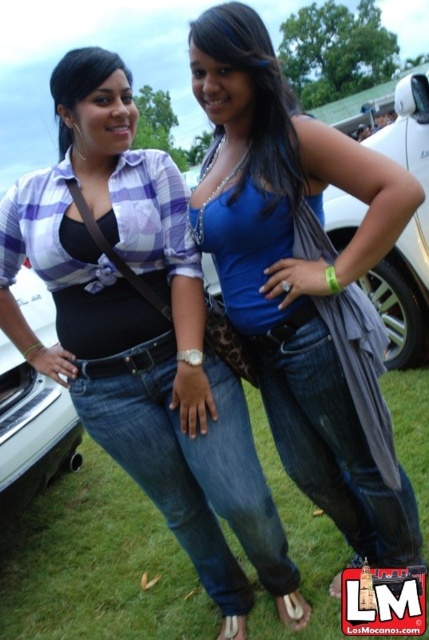
You are standing in a grassy area at an outdoor event and see two points marked in the scene. The first point is at coordinate point (251, 602) and the second point is at coordinate point (30, 400). Which point is closer to you?

Point (251, 602) is closer to the viewer than point (30, 400).

You are at an outdoor event and see the matte black tank top at center and the black leather car at left. Which object is higher up in the image?

The matte black tank top at center is taller than the black leather car at left.

You are at a car dealership and see two items with the same color and material. The matte black car at center and the matte black top at center. Which one is positioned higher up in the image?

The matte black car at center is located above the matte black top at center, so the matte black car at center is positioned higher up in the image.